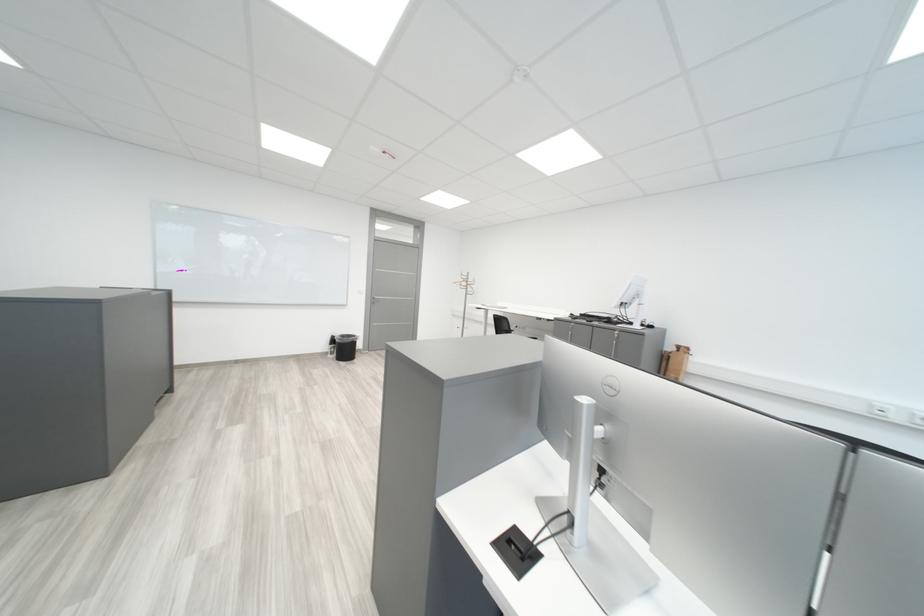
Where would you hang the coat rack hook? Please return your answer as a coordinate pair (x, y).

(467, 284)